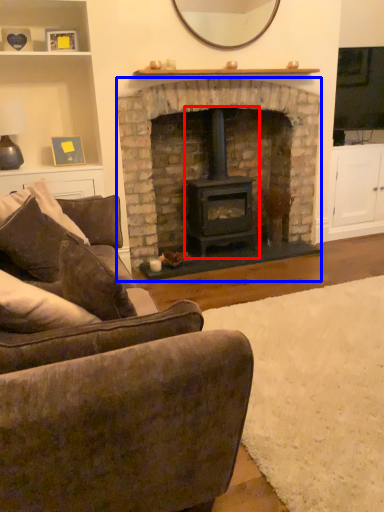
Question: Which object is closer to the camera taking this photo, wood burning stove (highlighted by a red box) or fireplace (highlighted by a blue box)?

Choices:
 (A) wood burning stove
 (B) fireplace

Answer: (B)